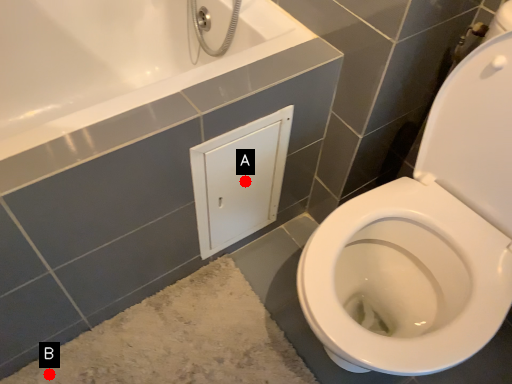
Question: Two points are circled on the image, labeled by A and B beside each circle. Among these points, which one is farthest from the camera?

Choices:
 (A) A is further
 (B) B is further

Answer: (A)